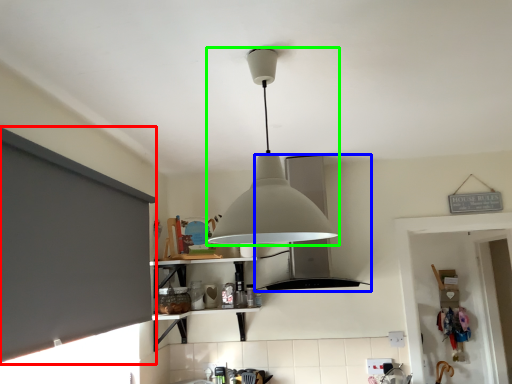
Question: Estimate the real-world distances between objects in this image. Which object is closer to window screen (highlighted by a red box), vent (highlighted by a blue box) or lamp (highlighted by a green box)?

Choices:
 (A) vent
 (B) lamp

Answer: (B)